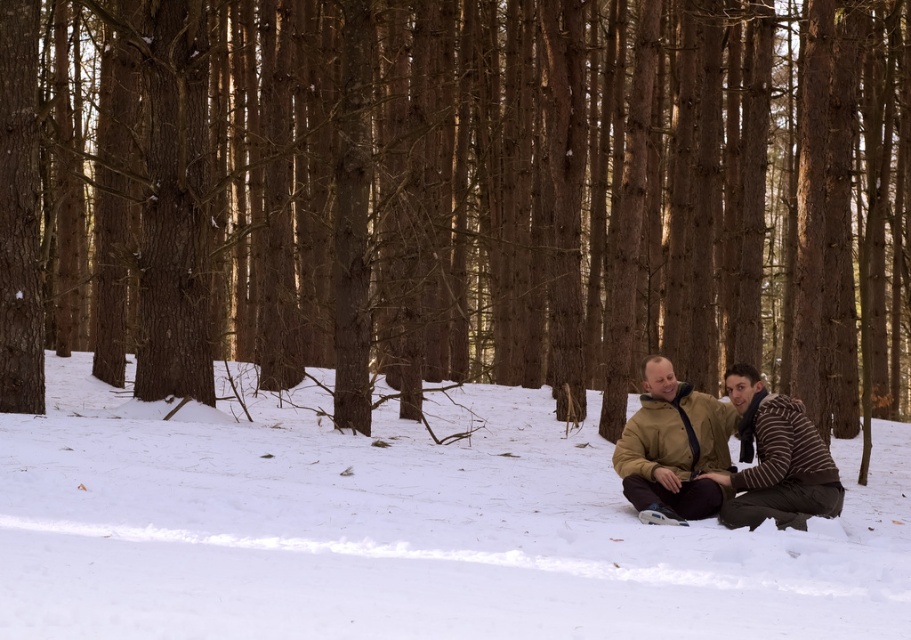
Question: Is brown rough tree at center bigger than tan leather jacket at center?

Choices:
 (A) no
 (B) yes

Answer: (B)

Question: Which of the following is the closest to the observer?

Choices:
 (A) (555, 595)
 (B) (657, 371)

Answer: (A)

Question: Which is farther from the white fluffy snow at center?

Choices:
 (A) brown rough tree at center
 (B) tan leather jacket at center

Answer: (A)

Question: Considering the real-world distances, which object is farthest from the brown rough tree at center?

Choices:
 (A) white fluffy snow at center
 (B) tan leather jacket at center

Answer: (B)

Question: Where is brown rough tree at center located in relation to white fluffy snow at center in the image?

Choices:
 (A) below
 (B) above

Answer: (B)

Question: Is brown rough tree at center below tan leather jacket at center?

Choices:
 (A) yes
 (B) no

Answer: (B)